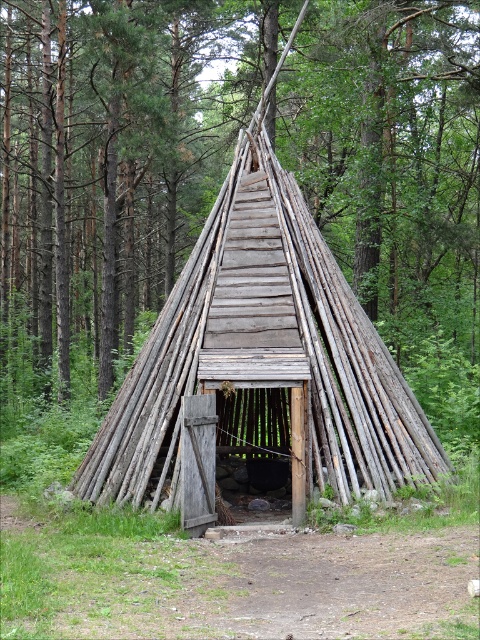
You are an architect assessing the structural integrity of the wooden hut at center and the weathered wood hut at center. Which one has a wider base for better stability?

The wooden hut at center has a larger width than the weathered wood hut at center, so it has a wider base for better stability.

You are standing in a forest and see the wooden hut at center and the weathered wood hut at center. Which one is higher up in the image?

The wooden hut at center is located above the weathered wood hut at center, so it is higher up in the image.

You are an explorer navigating through the forest and see the wooden hut at center and the weathered wood hut at center. Which one is closer to you?

The wooden hut at center is closer to you because the weathered wood hut at center is behind it.